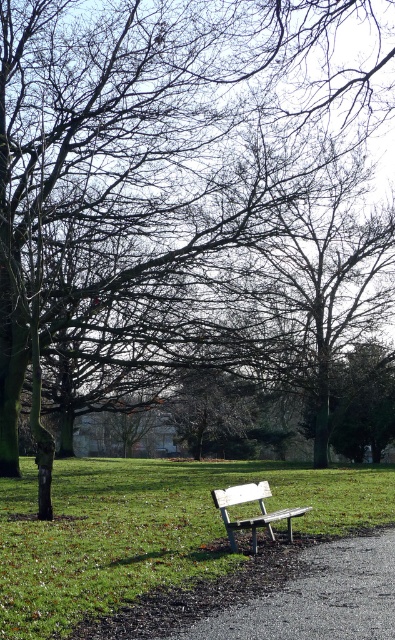
You are standing at the edge of the park and want to walk to the green grass at center. Which direction should you move to reach it?

You should move towards the center of the park to reach the green grass at center.

You are standing at the park and want to take a photo of both the point at coordinates point (69, 477) and point (255, 538). Which point will appear closer to the camera in the photo?

Point (69, 477) is further to the camera than point (255, 538), so it will appear closer to the camera in the photo.

You are planning to lay a new pathway in the park. You have a limited amount of gravel and want to know if the existing gravel path at center is wider than the green grass at center. Can you determine this based on the scene?

The green grass at center is bigger than gravel path at center, so the gravel path at center is narrower than the green grass at center. Therefore, the existing gravel path at center is not wider than the green grass at center.